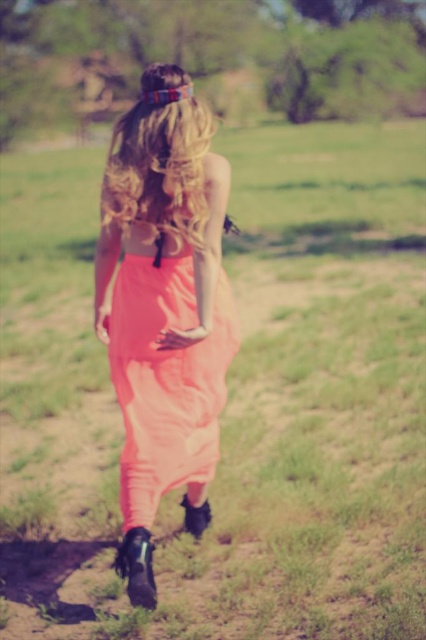
Does point (135, 480) lie behind point (120, 227)?

No, it is in front of (120, 227).

Find the location of `coral fabric skirt at center`. coral fabric skirt at center is located at coordinates (164, 308).

Between point (204, 420) and point (198, 172), which one is positioned behind?

Point (204, 420)

The image size is (426, 640). I want to click on coral fabric skirt at center, so click(164, 308).

Does coral fabric skirt at center appear over coral fabric dress at center?

Correct, coral fabric skirt at center is located above coral fabric dress at center.

Is point (207, 291) less distant than point (138, 493)?

That is True.

Where is `coral fabric skirt at center`? coral fabric skirt at center is located at coordinates (164, 308).

This screenshot has height=640, width=426. Find the location of `coral fabric skirt at center`. coral fabric skirt at center is located at coordinates (164, 308).

Which of these two, coral fabric dress at center or blonde hair at center, stands taller?

Standing taller between the two is coral fabric dress at center.

This screenshot has height=640, width=426. What do you see at coordinates (166, 380) in the screenshot?
I see `coral fabric dress at center` at bounding box center [166, 380].

Where is `coral fabric dress at center`? This screenshot has width=426, height=640. coral fabric dress at center is located at coordinates (166, 380).